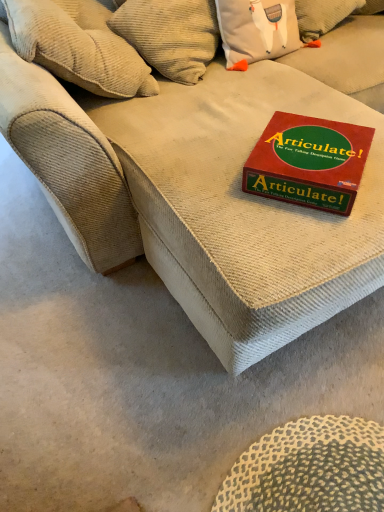
Describe the element at coordinates (308, 162) in the screenshot. I see `red cardboard game box at center` at that location.

What is the approximate height of beige corduroy couch at center?

It is 1.04 meters.

This screenshot has width=384, height=512. In order to click on beige corduroy pillow at upper left in this screenshot , I will do `click(78, 46)`.

From a real-world perspective, is beige corduroy pillow at upper left over beige corduroy couch at center?

No, from a real-world perspective, beige corduroy pillow at upper left is not over beige corduroy couch at center

Considering the sizes of objects beige corduroy pillow at upper left and beige corduroy couch at center in the image provided, who is taller, beige corduroy pillow at upper left or beige corduroy couch at center?

With more height is beige corduroy couch at center.

Is beige corduroy pillow at upper left placed right next to beige corduroy couch at center?

beige corduroy pillow at upper left and beige corduroy couch at center are clearly separated.

Is beige corduroy pillow at upper left wider or thinner than beige corduroy couch at center?

beige corduroy pillow at upper left is thinner than beige corduroy couch at center.

Identify the location of studio couch above the red cardboard game box at center (from the image's perspective). This screenshot has height=512, width=384. (202, 197).

Can you confirm if red cardboard game box at center is wider than beige corduroy couch at center?

No, red cardboard game box at center is not wider than beige corduroy couch at center.

Is red cardboard game box at center aimed at beige corduroy couch at center?

Yes.

Does point (68, 54) appear closer or farther from the camera than point (335, 126)?

Point (68, 54) is positioned farther from the camera compared to point (335, 126).

Is beige corduroy pillow at upper left to the left or to the right of red cardboard game box at center in the image?

beige corduroy pillow at upper left is to the left of red cardboard game box at center.

Could red cardboard game box at center be considered to be inside beige corduroy pillow at upper left?

Actually, red cardboard game box at center is outside beige corduroy pillow at upper left.

Between beige corduroy pillow at upper left and red cardboard game box at center, which one has larger size?

With larger size is beige corduroy pillow at upper left.

This screenshot has width=384, height=512. In order to click on studio couch on the right side of beige corduroy pillow at upper left in this screenshot , I will do `click(202, 197)`.

Is beige corduroy couch at center next to beige corduroy pillow at upper left?

No, beige corduroy couch at center is not next to beige corduroy pillow at upper left.

From a real-world perspective, is beige corduroy couch at center on beige corduroy pillow at upper left?

Indeed, from a real-world perspective, beige corduroy couch at center stands above beige corduroy pillow at upper left.

How much distance is there between beige corduroy couch at center and beige corduroy pillow at upper left?

beige corduroy couch at center and beige corduroy pillow at upper left are 15.27 inches apart.

Does point (360, 138) lie in front of point (58, 42)?

That is True.

Is red cardboard game box at center positioned with its back to beige corduroy pillow at upper left?

Yes, red cardboard game box at center is facing away from beige corduroy pillow at upper left.

Is red cardboard game box at center with beige corduroy pillow at upper left?

No, red cardboard game box at center is not with beige corduroy pillow at upper left.

Is point (175, 197) closer to camera compared to point (254, 155)?

No.

How distant is beige corduroy couch at center from red cardboard game box at center?

The distance of beige corduroy couch at center from red cardboard game box at center is 9.74 inches.

In the scene shown: Is beige corduroy couch at center looking in the opposite direction of red cardboard game box at center?

beige corduroy couch at center does not have its back to red cardboard game box at center.

Which of these two, beige corduroy couch at center or red cardboard game box at center, is wider?

beige corduroy couch at center is wider.

Locate an element on the screen. studio couch in front of the beige corduroy pillow at upper left is located at coordinates (202, 197).

Where is `paperback book behind the beige corduroy couch at center`? paperback book behind the beige corduroy couch at center is located at coordinates (308, 162).

Estimate the real-world distances between objects in this image. Which object is further from red cardboard game box at center, beige corduroy pillow at upper left or beige corduroy couch at center?

beige corduroy pillow at upper left is further to red cardboard game box at center.

Looking at the image, which one is located closer to beige corduroy couch at center, red cardboard game box at center or beige corduroy pillow at upper left?

red cardboard game box at center is positioned closer to the anchor beige corduroy couch at center.

Considering their positions, is beige corduroy couch at center positioned further to red cardboard game box at center than beige corduroy pillow at upper left?

Among the two, beige corduroy pillow at upper left is located further to red cardboard game box at center.

When comparing their distances from beige corduroy couch at center, does beige corduroy pillow at upper left or red cardboard game box at center seem closer?

red cardboard game box at center.

Considering their positions, is red cardboard game box at center positioned closer to beige corduroy pillow at upper left than beige corduroy couch at center?

beige corduroy couch at center.

From the image, which object appears to be farther from beige corduroy pillow at upper left, beige corduroy couch at center or red cardboard game box at center?

Among the two, red cardboard game box at center is located further to beige corduroy pillow at upper left.

Identify the location of paperback book located between beige corduroy pillow at upper left and beige corduroy couch at center in the left-right direction. (308, 162).